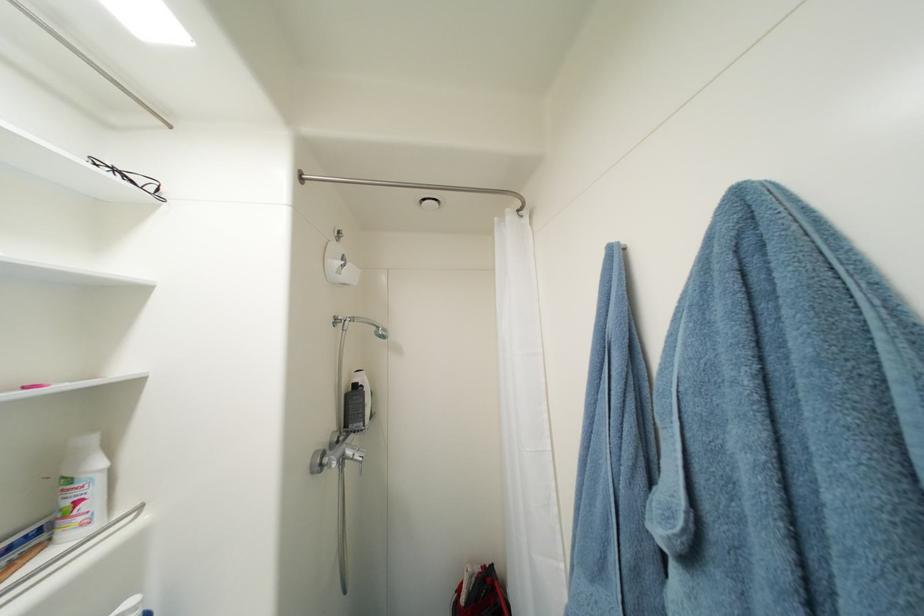
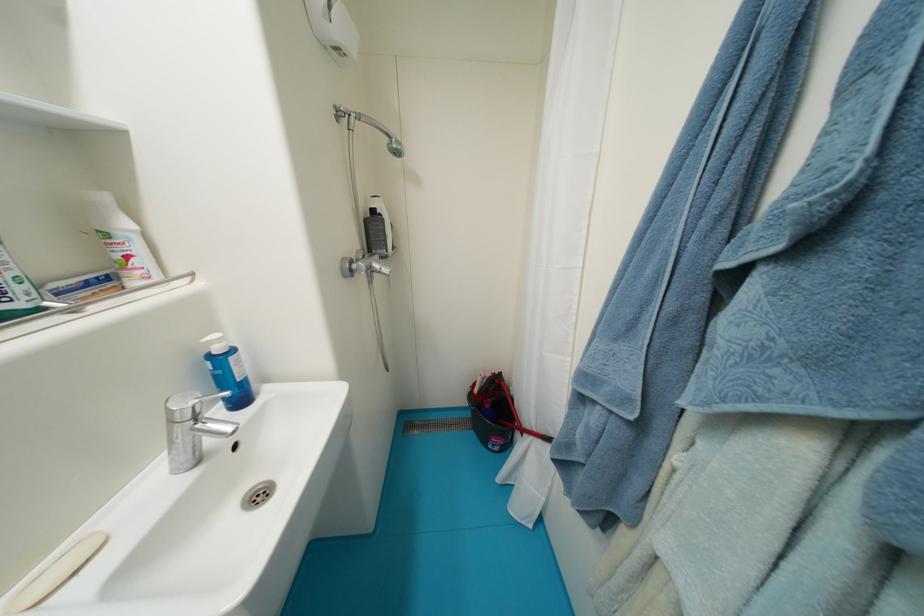
Locate, in the second image, the point that corresponds to (484,570) in the first image.

(495, 377)